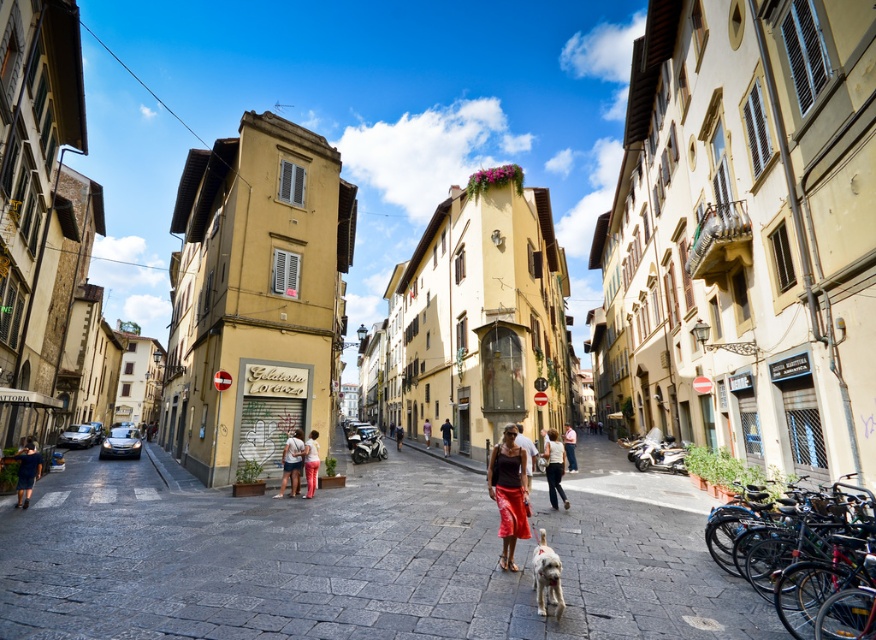
Does light beige pants at center have a greater height compared to light blue denim jeans at center?

In fact, light beige pants at center may be shorter than light blue denim jeans at center.

Does light beige pants at center appear under light blue denim jeans at center?

Incorrect, light beige pants at center is not positioned below light blue denim jeans at center.

Between point (546, 456) and point (569, 440), which one is positioned behind?

Point (569, 440)

Find the location of `light beige pants at center`. light beige pants at center is located at coordinates (555, 468).

Who is shorter, smooth stone alley at center or matte white shirt at center?

With less height is matte white shirt at center.

Based on the photo, can you confirm if smooth stone alley at center is shorter than matte white shirt at center?

In fact, smooth stone alley at center may be taller than matte white shirt at center.

Is point (323, 554) less distant than point (281, 490)?

Yes.

This screenshot has width=876, height=640. In order to click on smooth stone alley at center in this screenshot , I will do `click(362, 556)`.

Is matte black tank top at center above light blue denim jeans at center?

Indeed, matte black tank top at center is positioned over light blue denim jeans at center.

Looking at this image, is matte black tank top at center closer to camera compared to light blue denim jeans at center?

Yes.

Which is in front, point (512, 458) or point (569, 452)?

Point (512, 458)

The image size is (876, 640). I want to click on matte black tank top at center, so click(x=507, y=492).